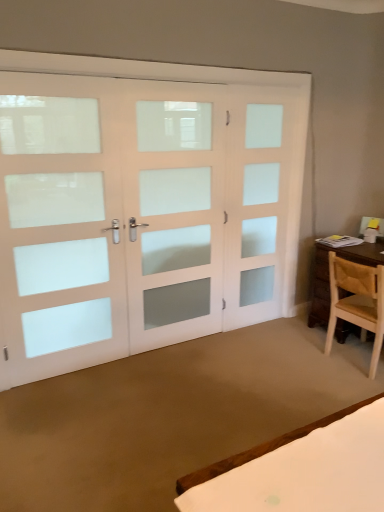
Question: Can you confirm if white frosted glass door at left, the first screen door from the left, is positioned to the left of white frosted glass door at center, placed as the second screen door when sorted from left to right?

Choices:
 (A) yes
 (B) no

Answer: (A)

Question: From the image's perspective, is white frosted glass door at left, the first screen door from the left, below white frosted glass door at center, placed as the second screen door when sorted from left to right?

Choices:
 (A) no
 (B) yes

Answer: (B)

Question: Is white frosted glass door at left, positioned as the third screen door in right-to-left order, wider than white frosted glass door at center, which ranks as the 2th screen door in right-to-left order?

Choices:
 (A) no
 (B) yes

Answer: (A)

Question: Are white frosted glass door at left, positioned as the third screen door in right-to-left order, and white frosted glass door at center, placed as the second screen door when sorted from left to right, making contact?

Choices:
 (A) no
 (B) yes

Answer: (A)

Question: Considering the relative sizes of white frosted glass door at left, the first screen door from the left, and white frosted glass door at center, placed as the second screen door when sorted from left to right, in the image provided, is white frosted glass door at left, the first screen door from the left, taller than white frosted glass door at center, placed as the second screen door when sorted from left to right,?

Choices:
 (A) yes
 (B) no

Answer: (A)

Question: Considering the positions of white frosted glass door at right, which appears as the 3th screen door when viewed from the left, and light brown wooden chair at right in the image, is white frosted glass door at right, which appears as the 3th screen door when viewed from the left, wider or thinner than light brown wooden chair at right?

Choices:
 (A) thin
 (B) wide

Answer: (A)

Question: Which is correct: white frosted glass door at right, placed as the first screen door when sorted from right to left, is inside light brown wooden chair at right, or outside of it?

Choices:
 (A) inside
 (B) outside

Answer: (B)

Question: Is white frosted glass door at right, placed as the first screen door when sorted from right to left, taller or shorter than light brown wooden chair at right?

Choices:
 (A) short
 (B) tall

Answer: (B)

Question: Is white frosted glass door at right, placed as the first screen door when sorted from right to left, to the left or to the right of light brown wooden chair at right in the image?

Choices:
 (A) left
 (B) right

Answer: (A)

Question: Considering the positions of light brown wooden chair at right and white frosted glass door at center, which ranks as the 2th screen door in right-to-left order, in the image, is light brown wooden chair at right taller or shorter than white frosted glass door at center, which ranks as the 2th screen door in right-to-left order,?

Choices:
 (A) tall
 (B) short

Answer: (B)

Question: In the image, is light brown wooden chair at right positioned in front of or behind white frosted glass door at center, which ranks as the 2th screen door in right-to-left order?

Choices:
 (A) behind
 (B) front

Answer: (A)

Question: Visually, is light brown wooden chair at right positioned to the left or to the right of white frosted glass door at center, which ranks as the 2th screen door in right-to-left order?

Choices:
 (A) left
 (B) right

Answer: (B)

Question: From a real-world perspective, is light brown wooden chair at right positioned above or below white frosted glass door at center, placed as the second screen door when sorted from left to right?

Choices:
 (A) above
 (B) below

Answer: (B)

Question: Considering the positions of white frosted glass door at center, which ranks as the 2th screen door in right-to-left order, and white frosted glass door at right, placed as the first screen door when sorted from right to left, in the image, is white frosted glass door at center, which ranks as the 2th screen door in right-to-left order, bigger or smaller than white frosted glass door at right, placed as the first screen door when sorted from right to left,?

Choices:
 (A) big
 (B) small

Answer: (A)

Question: From the image's perspective, is white frosted glass door at center, placed as the second screen door when sorted from left to right, above or below white frosted glass door at right, placed as the first screen door when sorted from right to left?

Choices:
 (A) above
 (B) below

Answer: (B)